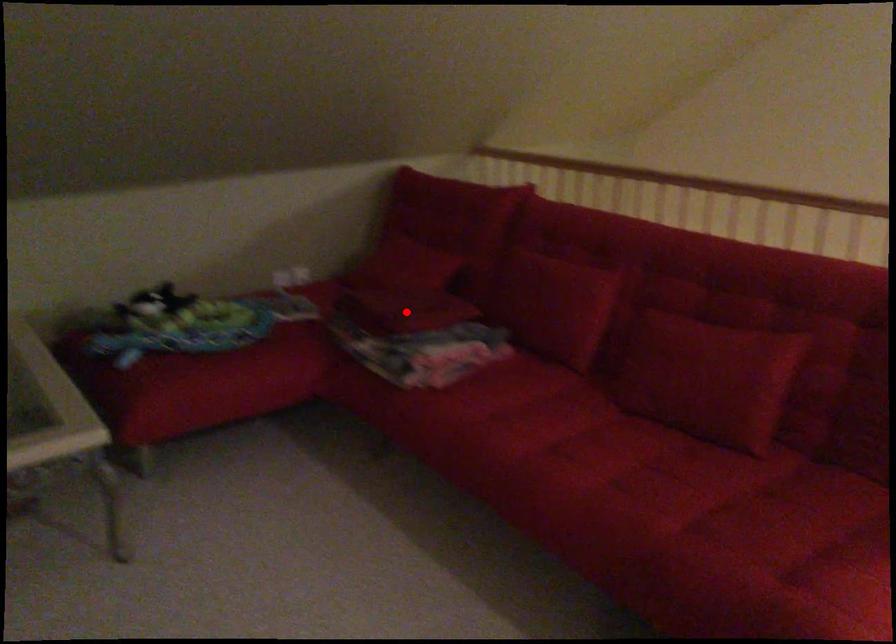
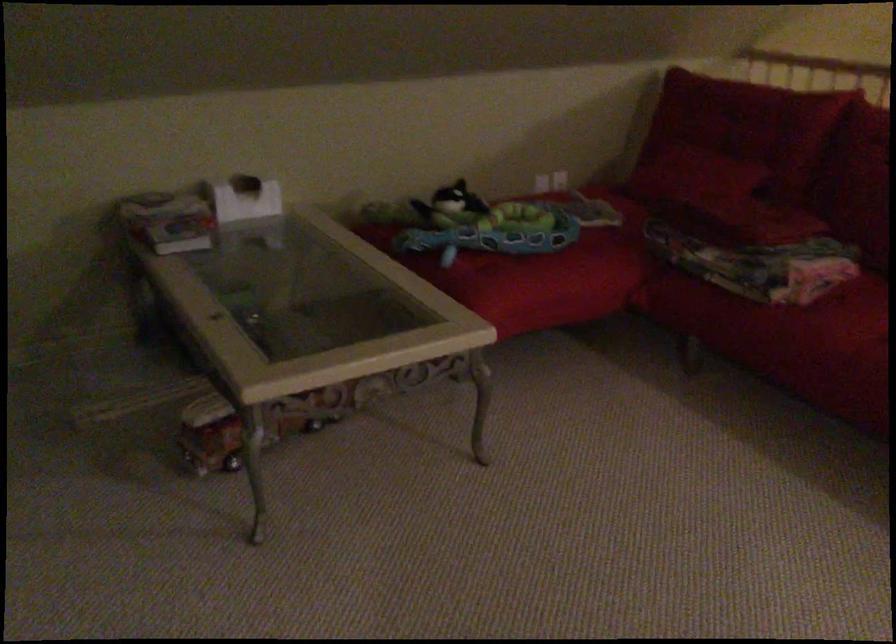
Question: I am providing you with two images of the same scene from different viewpoints. Image1 has a red point marked. In image2, the corresponding 3D location appears at what relative position? Reply with the corresponding letter.

Choices:
 (A) Closer
 (B) Farther

Answer: (A)